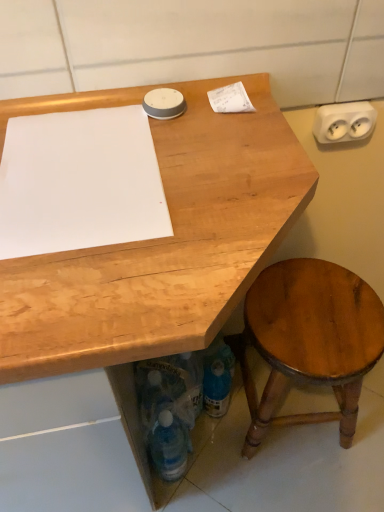
Measure the distance between wooden desk at center and camera.

A distance of 15.72 inches exists between wooden desk at center and camera.

In order to face translucent plastic bottle at lower center, which ranks as the 2th bottle in left-to-right order, should I rotate leftwards or rightwards?

It's best to rotate right around 0.110 degrees.

Describe the element at coordinates (310, 340) in the screenshot. I see `shiny brown wood stool at lower right` at that location.

The height and width of the screenshot is (512, 384). I want to click on translucent plastic bottle at lower center, the 2th bottle positioned from the right, so click(168, 446).

What is the approximate width of white plastic electrical outlet at upper right?

3.31 centimeters.

What is the approximate width of white paper at upper left, arranged as the first notepad when ordered from the bottom?

It is 12.32 inches.

Locate an element on the screen. This screenshot has width=384, height=512. wooden desk at center is located at coordinates (165, 247).

Which of these two, white paper at upper right, positioned as the 2th notepad in left-to-right order, or translucent plastic bottle at lower center, which ranks as the 2th bottle in left-to-right order, stands shorter?

white paper at upper right, positioned as the 2th notepad in left-to-right order, is shorter.

Consider the image. Considering their positions, is white paper at upper right, positioned as the 2th notepad in left-to-right order, located in front of or behind translucent plastic bottle at lower center, arranged as the first bottle when viewed from the right?

white paper at upper right, positioned as the 2th notepad in left-to-right order, is positioned closer to the viewer than translucent plastic bottle at lower center, arranged as the first bottle when viewed from the right.

Is translucent plastic bottle at lower center, which ranks as the 2th bottle in left-to-right order, completely or partially inside white paper at upper right, placed as the first notepad when sorted from top to bottom?

Actually, translucent plastic bottle at lower center, which ranks as the 2th bottle in left-to-right order, is outside white paper at upper right, placed as the first notepad when sorted from top to bottom.

Considering the positions of points (216, 96) and (199, 354), is point (216, 96) farther from camera compared to point (199, 354)?

No, it is in front of (199, 354).

From the image's perspective, which one is positioned higher, white paper at upper right, acting as the second notepad starting from the bottom, or white plastic electrical outlet at upper right?

white plastic electrical outlet at upper right.

Which object is further away from the camera, white paper at upper right, positioned as the 2th notepad in left-to-right order, or white plastic electrical outlet at upper right?

white plastic electrical outlet at upper right is more distant.

Between point (216, 102) and point (317, 124), which one is positioned in front?

Positioned in front is point (216, 102).

Can you see white paper at upper right, placed as the first notepad when sorted from top to bottom, touching wooden desk at center?

white paper at upper right, placed as the first notepad when sorted from top to bottom, and wooden desk at center are clearly separated.

From a real-world perspective, who is located higher, white paper at upper right, the first notepad in the right-to-left sequence, or wooden desk at center?

white paper at upper right, the first notepad in the right-to-left sequence, from a real-world perspective.

From the image's perspective, is white paper at upper right, acting as the second notepad starting from the bottom, below wooden desk at center?

No, from the image's perspective, white paper at upper right, acting as the second notepad starting from the bottom, is not beneath wooden desk at center.

Can you tell me how much white paper at upper right, placed as the first notepad when sorted from top to bottom, and wooden desk at center differ in facing direction?

2.82 degrees.

Find the location of a particular element. Image resolution: width=384 pixels, height=512 pixels. the 2nd notepad directly above the translucent plastic bottle at lower center, the 2th bottle positioned from the right (from a real-world perspective) is located at coordinates (230, 99).

From the image's perspective, is white paper at upper right, the first notepad in the right-to-left sequence, under translucent plastic bottle at lower center, the 2th bottle positioned from the right?

No, from the image's perspective, white paper at upper right, the first notepad in the right-to-left sequence, is not beneath translucent plastic bottle at lower center, the 2th bottle positioned from the right.

Looking at this image, from a real-world perspective, relative to translucent plastic bottle at lower center, which is the 1th bottle from left to right, is white paper at upper right, the first notepad in the right-to-left sequence, vertically above or below?

Clearly, from a real-world perspective, white paper at upper right, the first notepad in the right-to-left sequence, is above translucent plastic bottle at lower center, which is the 1th bottle from left to right.

Does white paper at upper right, positioned as the 2th notepad in left-to-right order, turn towards translucent plastic bottle at lower center, the 2th bottle positioned from the right?

No, white paper at upper right, positioned as the 2th notepad in left-to-right order, is not facing towards translucent plastic bottle at lower center, the 2th bottle positioned from the right.

Is white plastic electrical outlet at upper right far from white paper at upper left, arranged as the first notepad when ordered from the bottom?

white plastic electrical outlet at upper right is near white paper at upper left, arranged as the first notepad when ordered from the bottom, not far away.

Do you think white plastic electrical outlet at upper right is within white paper at upper left, which is the second notepad from right to left, or outside of it?

white plastic electrical outlet at upper right is outside white paper at upper left, which is the second notepad from right to left.

From a real-world perspective, relative to white paper at upper left, which is the second notepad from right to left, is white plastic electrical outlet at upper right vertically above or below?

In terms of real-world spatial position, white plastic electrical outlet at upper right is below white paper at upper left, which is the second notepad from right to left.

Which object is further away from the camera taking this photo, white plastic electrical outlet at upper right or white paper at upper left, arranged as the first notepad when ordered from the bottom?

white plastic electrical outlet at upper right is more distant.

How far apart are white plastic electrical outlet at upper right and translucent plastic bottle at lower center, the 2th bottle positioned from the right?

white plastic electrical outlet at upper right is 28.81 inches from translucent plastic bottle at lower center, the 2th bottle positioned from the right.

Considering their positions, is white plastic electrical outlet at upper right located in front of or behind translucent plastic bottle at lower center, the 2th bottle positioned from the right?

Visually, white plastic electrical outlet at upper right is located in front of translucent plastic bottle at lower center, the 2th bottle positioned from the right.

Does white plastic electrical outlet at upper right contain translucent plastic bottle at lower center, which is the 1th bottle from left to right?

Actually, translucent plastic bottle at lower center, which is the 1th bottle from left to right, is outside white plastic electrical outlet at upper right.

Considering the positions of objects white plastic electrical outlet at upper right and translucent plastic bottle at lower center, the 2th bottle positioned from the right, in the image provided, who is more to the right, white plastic electrical outlet at upper right or translucent plastic bottle at lower center, the 2th bottle positioned from the right,?

white plastic electrical outlet at upper right is more to the right.

Does wooden desk at center come behind white paper at upper left, acting as the second notepad starting from the top?

That is False.

Would you say wooden desk at center is inside or outside white paper at upper left, which is the second notepad from right to left?

wooden desk at center is not inside white paper at upper left, which is the second notepad from right to left, it's outside.

From the image's perspective, starting from the wooden desk at center, which notepad is the 1st one above? Please provide its 2D coordinates.

[(79, 182)]

From the image's perspective, which is above, wooden desk at center or white paper at upper left, acting as the second notepad starting from the top?

white paper at upper left, acting as the second notepad starting from the top, is shown above in the image.

Image resolution: width=384 pixels, height=512 pixels. I want to click on the 1st bottle to the left of the white paper at upper right, placed as the first notepad when sorted from top to bottom, counting from the anchor's position, so tap(189, 381).

Identify the location of electric outlet that is on the right side of white paper at upper right, placed as the first notepad when sorted from top to bottom. Image resolution: width=384 pixels, height=512 pixels. (344, 122).

Looking at the image, which one is located closer to white plastic electrical outlet at upper right, white paper at upper right, positioned as the 2th notepad in left-to-right order, or white paper at upper left, arranged as the first notepad when ordered from the bottom?

white paper at upper right, positioned as the 2th notepad in left-to-right order, is closer to white plastic electrical outlet at upper right.

When comparing their distances from shiny brown wood stool at lower right, does white paper at upper left, which is the second notepad from right to left, or translucent plastic bottle at lower center, which ranks as the 2th bottle in left-to-right order, seem further?

white paper at upper left, which is the second notepad from right to left.

From the image, which object appears to be farther from white paper at upper right, the first notepad in the right-to-left sequence, translucent plastic bottle at lower center, which is the 1th bottle from left to right, or white plastic electrical outlet at upper right?

Based on the image, translucent plastic bottle at lower center, which is the 1th bottle from left to right, appears to be further to white paper at upper right, the first notepad in the right-to-left sequence.

Estimate the real-world distances between objects in this image. Which object is further from shiny brown wood stool at lower right, white paper at upper right, placed as the first notepad when sorted from top to bottom, or wooden desk at center?

Among the two, white paper at upper right, placed as the first notepad when sorted from top to bottom, is located further to shiny brown wood stool at lower right.

From the image, which object appears to be nearer to translucent plastic bottle at lower center, arranged as the first bottle when viewed from the right, wooden desk at center or white plastic electrical outlet at upper right?

Among the two, wooden desk at center is located nearer to translucent plastic bottle at lower center, arranged as the first bottle when viewed from the right.

When comparing their distances from white paper at upper left, which is the 1th notepad in left-to-right order, does wooden desk at center or shiny brown wood stool at lower right seem further?

shiny brown wood stool at lower right lies further to white paper at upper left, which is the 1th notepad in left-to-right order, than the other object.

When comparing their distances from shiny brown wood stool at lower right, does white paper at upper right, the first notepad in the right-to-left sequence, or translucent plastic bottle at lower center, arranged as the first bottle when viewed from the right, seem closer?

Among the two, translucent plastic bottle at lower center, arranged as the first bottle when viewed from the right, is located nearer to shiny brown wood stool at lower right.

From the image, which object appears to be nearer to translucent plastic bottle at lower center, arranged as the first bottle when viewed from the right, translucent plastic bottle at lower center, which is the 1th bottle from left to right, or shiny brown wood stool at lower right?

translucent plastic bottle at lower center, which is the 1th bottle from left to right, is positioned closer to the anchor translucent plastic bottle at lower center, arranged as the first bottle when viewed from the right.

Locate an element on the screen. This screenshot has width=384, height=512. desk between white plastic electrical outlet at upper right and shiny brown wood stool at lower right in the vertical direction is located at coordinates (165, 247).

Locate an element on the screen. stool that lies between white plastic electrical outlet at upper right and translucent plastic bottle at lower center, which ranks as the 2th bottle in left-to-right order, from top to bottom is located at coordinates (310, 340).

Find the location of a particular element. The width and height of the screenshot is (384, 512). electric outlet between wooden desk at center and translucent plastic bottle at lower center, arranged as the first bottle when viewed from the right, from front to back is located at coordinates (344, 122).

At what (x,y) coordinates should I click in order to perform the action: click on notepad between white paper at upper right, placed as the first notepad when sorted from top to bottom, and translucent plastic bottle at lower center, arranged as the first bottle when viewed from the right, in the vertical direction. Please return your answer as a coordinate pair (x, y). The width and height of the screenshot is (384, 512). Looking at the image, I should click on [x=79, y=182].